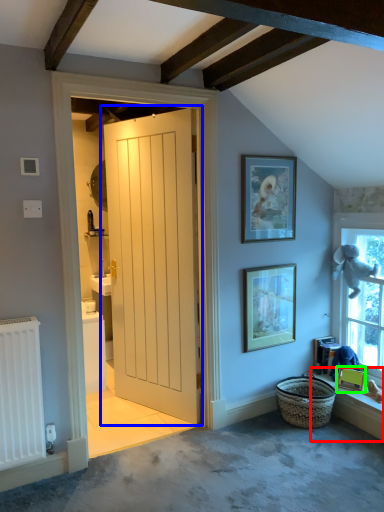
Question: Based on their relative distances, which object is nearer to window sill (highlighted by a red box)? Choose from door (highlighted by a blue box) and picture frame (highlighted by a green box).

Choices:
 (A) door
 (B) picture frame

Answer: (B)